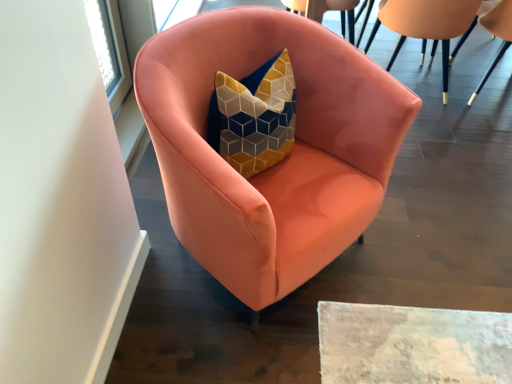
Question: Is matte pink armchair at upper right, which ranks as the 3th chair in left-to-right order, facing towards matte pink armchair at upper right, the second chair from the right?

Choices:
 (A) no
 (B) yes

Answer: (A)

Question: Is matte pink armchair at upper right, which ranks as the 3th chair in left-to-right order, bigger than matte pink armchair at upper right, the second chair from the right?

Choices:
 (A) no
 (B) yes

Answer: (A)

Question: Is matte pink armchair at upper right, marked as the 1th chair in a right-to-left arrangement, positioned far away from matte pink armchair at upper right, the 2th chair in the left-to-right sequence?

Choices:
 (A) yes
 (B) no

Answer: (B)

Question: From a real-world perspective, is matte pink armchair at upper right, which ranks as the 3th chair in left-to-right order, over matte pink armchair at upper right, the second chair from the right?

Choices:
 (A) yes
 (B) no

Answer: (B)

Question: Does matte pink armchair at upper right, marked as the 1th chair in a right-to-left arrangement, have a greater width compared to matte pink armchair at upper right, the second chair from the right?

Choices:
 (A) yes
 (B) no

Answer: (B)

Question: Considering the positions of point (x=266, y=223) and point (x=489, y=9), is point (x=266, y=223) closer or farther from the camera than point (x=489, y=9)?

Choices:
 (A) farther
 (B) closer

Answer: (B)

Question: Which is correct: matte pink armchair at center, the 3th chair when ordered from right to left, is inside matte pink armchair at upper right, which ranks as the 3th chair in left-to-right order, or outside of it?

Choices:
 (A) outside
 (B) inside

Answer: (A)

Question: From a real-world perspective, relative to matte pink armchair at upper right, which ranks as the 3th chair in left-to-right order, is matte pink armchair at center, which is the 1th chair from left to right, vertically above or below?

Choices:
 (A) above
 (B) below

Answer: (A)

Question: From the image's perspective, is matte pink armchair at center, the 3th chair when ordered from right to left, positioned above or below matte pink armchair at upper right, which ranks as the 3th chair in left-to-right order?

Choices:
 (A) above
 (B) below

Answer: (B)

Question: Considering their positions, is matte pink armchair at upper right, marked as the 1th chair in a right-to-left arrangement, located in front of or behind matte pink armchair at center, the 3th chair when ordered from right to left?

Choices:
 (A) front
 (B) behind

Answer: (B)

Question: In terms of size, does matte pink armchair at upper right, marked as the 1th chair in a right-to-left arrangement, appear bigger or smaller than matte pink armchair at center, which is the 1th chair from left to right?

Choices:
 (A) small
 (B) big

Answer: (A)

Question: From their relative heights in the image, would you say matte pink armchair at upper right, which ranks as the 3th chair in left-to-right order, is taller or shorter than matte pink armchair at center, the 3th chair when ordered from right to left?

Choices:
 (A) tall
 (B) short

Answer: (B)

Question: Is matte pink armchair at upper right, which ranks as the 3th chair in left-to-right order, wider or thinner than matte pink armchair at center, which is the 1th chair from left to right?

Choices:
 (A) thin
 (B) wide

Answer: (A)

Question: From a real-world perspective, relative to matte pink armchair at center, the 3th chair when ordered from right to left, is matte pink armchair at upper right, the 2th chair in the left-to-right sequence, vertically above or below?

Choices:
 (A) below
 (B) above

Answer: (A)

Question: Would you say matte pink armchair at upper right, the 2th chair in the left-to-right sequence, is inside or outside matte pink armchair at center, the 3th chair when ordered from right to left?

Choices:
 (A) inside
 (B) outside

Answer: (B)